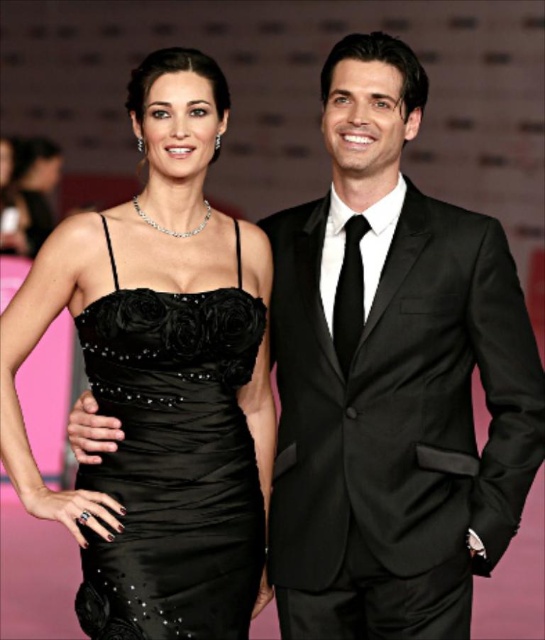
Which is behind, point (319, 582) or point (143, 445)?

Point (319, 582)

Can you confirm if shiny black suit at right is bigger than black satin dress at center?

Yes.

In order to click on shiny black suit at right in this screenshot , I will do `click(391, 378)`.

Where is `shiny black suit at right`? shiny black suit at right is located at coordinates (391, 378).